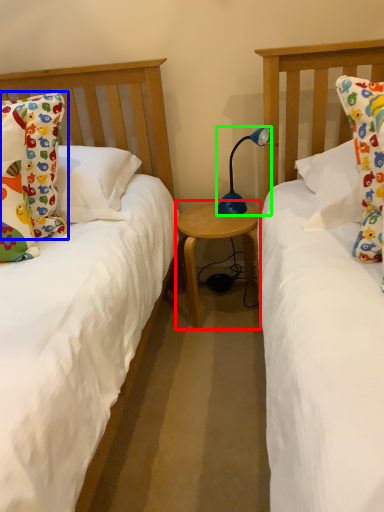
Question: Considering the real-world distances, which object is closest to table (highlighted by a red box)? pillow (highlighted by a blue box) or lamp (highlighted by a green box).

Choices:
 (A) pillow
 (B) lamp

Answer: (B)